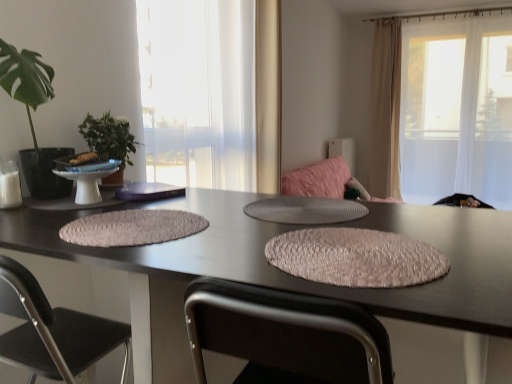
Question: Should I look upward or downward to see translucent glass window at center, the 2th window viewed from the back?

Choices:
 (A) up
 (B) down

Answer: (A)

Question: Can you confirm if black fabric chair at lower left is shorter than green leafy plant at left, which appears as the 1th houseplant when viewed from the back?

Choices:
 (A) yes
 (B) no

Answer: (B)

Question: Is black fabric chair at lower left far from green leafy plant at left, positioned as the second houseplant in front-to-back order?

Choices:
 (A) yes
 (B) no

Answer: (B)

Question: Is black fabric chair at lower left thinner than green leafy plant at left, positioned as the second houseplant in front-to-back order?

Choices:
 (A) no
 (B) yes

Answer: (A)

Question: Is black fabric chair at lower left smaller than green leafy plant at left, which appears as the 1th houseplant when viewed from the back?

Choices:
 (A) yes
 (B) no

Answer: (B)

Question: Considering the relative sizes of black fabric chair at lower left and green leafy plant at left, positioned as the second houseplant in front-to-back order, in the image provided, is black fabric chair at lower left bigger than green leafy plant at left, positioned as the second houseplant in front-to-back order,?

Choices:
 (A) no
 (B) yes

Answer: (B)

Question: From a real-world perspective, does black fabric chair at lower left stand above green leafy plant at left, positioned as the second houseplant in front-to-back order?

Choices:
 (A) no
 (B) yes

Answer: (A)

Question: Can we say black fabric chair at lower left lies outside translucent fabric window at upper right, positioned as the first window in back-to-front order?

Choices:
 (A) no
 (B) yes

Answer: (B)

Question: Is black fabric chair at lower left surrounding translucent fabric window at upper right, which is the second window in left-to-right order?

Choices:
 (A) yes
 (B) no

Answer: (B)

Question: Is black fabric chair at lower left turned away from translucent fabric window at upper right, which is the second window in left-to-right order?

Choices:
 (A) yes
 (B) no

Answer: (B)

Question: Is black fabric chair at lower left behind translucent fabric window at upper right, which is the second window in left-to-right order?

Choices:
 (A) yes
 (B) no

Answer: (B)

Question: Are black fabric chair at lower left and translucent fabric window at upper right, positioned as the first window in back-to-front order, beside each other?

Choices:
 (A) yes
 (B) no

Answer: (B)

Question: Does black fabric chair at lower left have a greater height compared to translucent fabric window at upper right, positioned as the first window in back-to-front order?

Choices:
 (A) yes
 (B) no

Answer: (B)

Question: Does textured beige placemat at center, which is the 2th yoga mat in right-to-left order, have a lesser height compared to green leafy plant at left, positioned as the second houseplant in front-to-back order?

Choices:
 (A) yes
 (B) no

Answer: (A)